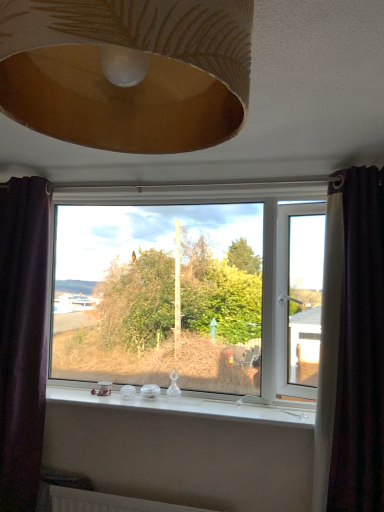
Question: Does transparent glass window at center have a greater width compared to dark purple velvet curtain at right, arranged as the second curtain when viewed from the left?

Choices:
 (A) yes
 (B) no

Answer: (B)

Question: Is transparent glass window at center completely or partially outside of dark purple velvet curtain at right, which is counted as the first curtain, starting from the right?

Choices:
 (A) yes
 (B) no

Answer: (A)

Question: From a real-world perspective, is transparent glass window at center under dark purple velvet curtain at right, arranged as the second curtain when viewed from the left?

Choices:
 (A) yes
 (B) no

Answer: (B)

Question: From a real-world perspective, is transparent glass window at center over dark purple velvet curtain at right, which is counted as the first curtain, starting from the right?

Choices:
 (A) yes
 (B) no

Answer: (A)

Question: Is transparent glass window at center turned away from dark purple velvet curtain at right, arranged as the second curtain when viewed from the left?

Choices:
 (A) yes
 (B) no

Answer: (B)

Question: Can you confirm if transparent glass window at center is shorter than dark purple velvet curtain at right, arranged as the second curtain when viewed from the left?

Choices:
 (A) yes
 (B) no

Answer: (A)

Question: From a real-world perspective, is transparent glass window at center over gold textured lampshade at upper center?

Choices:
 (A) yes
 (B) no

Answer: (B)

Question: Considering the relative positions of transparent glass window at center and gold textured lampshade at upper center in the image provided, is transparent glass window at center to the right of gold textured lampshade at upper center from the viewer's perspective?

Choices:
 (A) yes
 (B) no

Answer: (B)

Question: Is transparent glass window at center wider than gold textured lampshade at upper center?

Choices:
 (A) no
 (B) yes

Answer: (A)

Question: Is transparent glass window at center with gold textured lampshade at upper center?

Choices:
 (A) no
 (B) yes

Answer: (A)

Question: Considering the relative positions of transparent glass window at center and gold textured lampshade at upper center in the image provided, is transparent glass window at center behind gold textured lampshade at upper center?

Choices:
 (A) no
 (B) yes

Answer: (B)

Question: From the image's perspective, is transparent glass window at center located above gold textured lampshade at upper center?

Choices:
 (A) yes
 (B) no

Answer: (B)

Question: Can you confirm if white glossy window sill at center is wider than purple fabric curtain at left, positioned as the 1th curtain in left-to-right order?

Choices:
 (A) yes
 (B) no

Answer: (A)